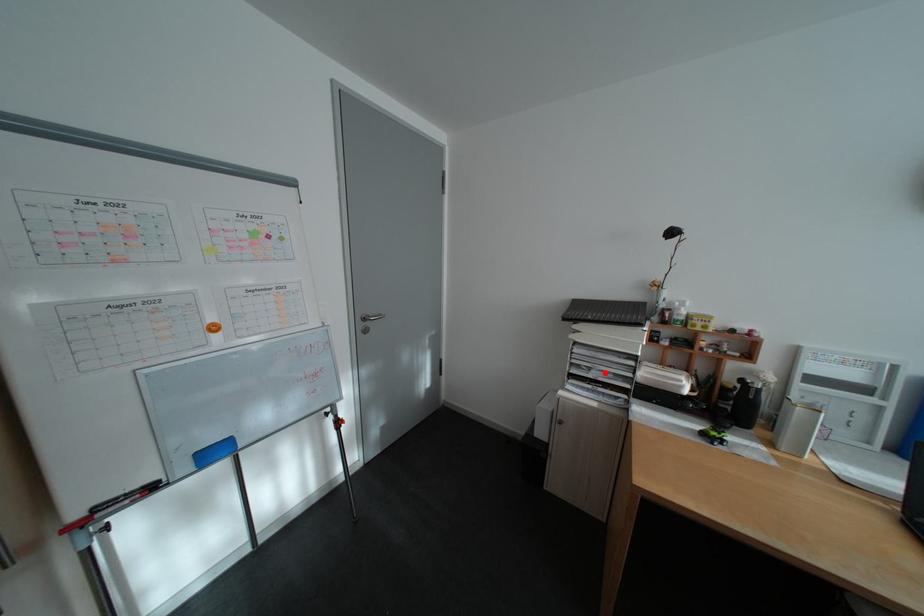
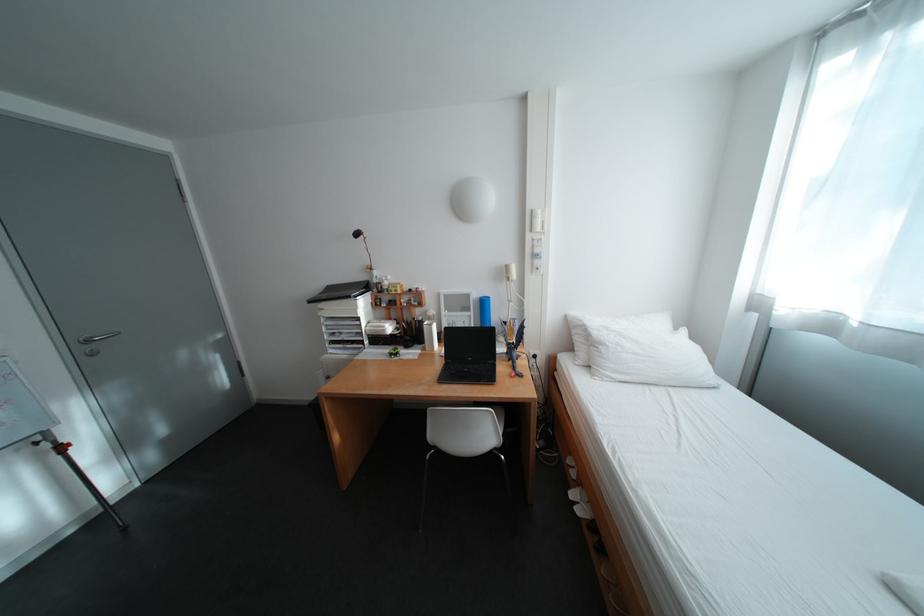
In the second image, find the point that corresponds to the highlighted location in the first image.

(355, 336)